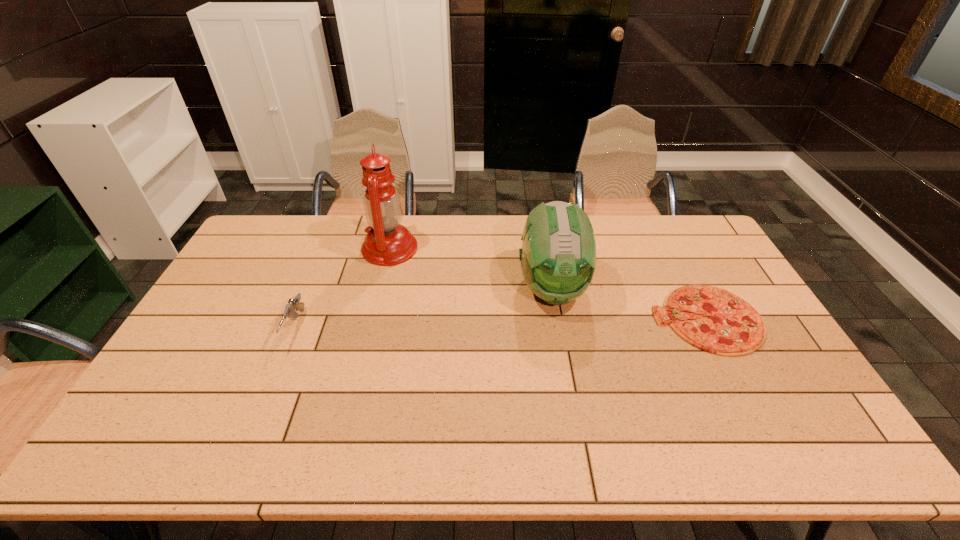
Identify the location of vacant space located 0.260m on the visor of the second tallest object. The image size is (960, 540). (571, 396).

In order to click on free space located on the front-facing side of the padlock in this screenshot , I will do `click(577, 262)`.

This screenshot has width=960, height=540. I want to click on vacant region located at the barrel of the leftmost object, so click(x=247, y=448).

Where is `vacant space located on the back of the shortest object`? vacant space located on the back of the shortest object is located at coordinates (660, 227).

Identify the location of oil lamp positioned at the far edge. (387, 243).

Locate an element on the screen. padlock that is at the far edge is located at coordinates (570, 202).

The width and height of the screenshot is (960, 540). In order to click on object that is at the right edge in this screenshot , I will do `click(730, 326)`.

Locate an element on the screen. The width and height of the screenshot is (960, 540). vacant space at the far edge of the desktop is located at coordinates (621, 216).

Identify the location of vacant area at the near edge of the desktop. (481, 460).

In the image, there is a desktop. At what (x,y) coordinates should I click in order to perform the action: click on vacant area at the left edge. Please return your answer as a coordinate pair (x, y). The width and height of the screenshot is (960, 540). Looking at the image, I should click on (183, 404).